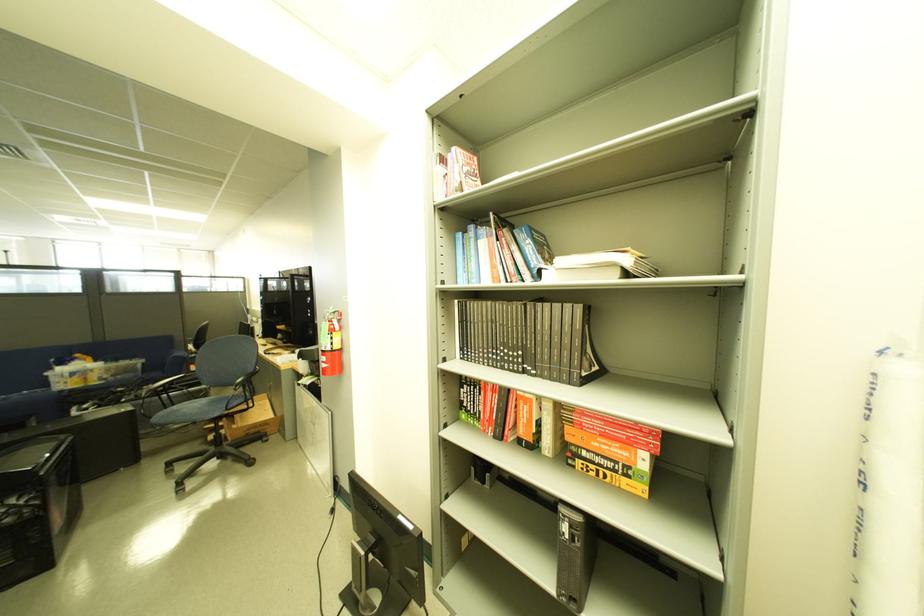
What do you see at coordinates (331, 339) in the screenshot? The image size is (924, 616). I see `a extinguisher lever handle` at bounding box center [331, 339].